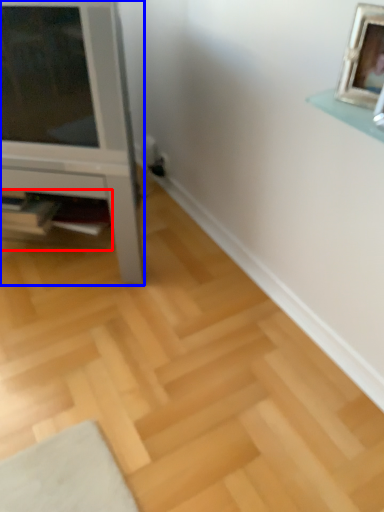
Question: Which of the following is the farthest to the observer, shelf (highlighted by a red box) or furniture (highlighted by a blue box)?

Choices:
 (A) shelf
 (B) furniture

Answer: (A)